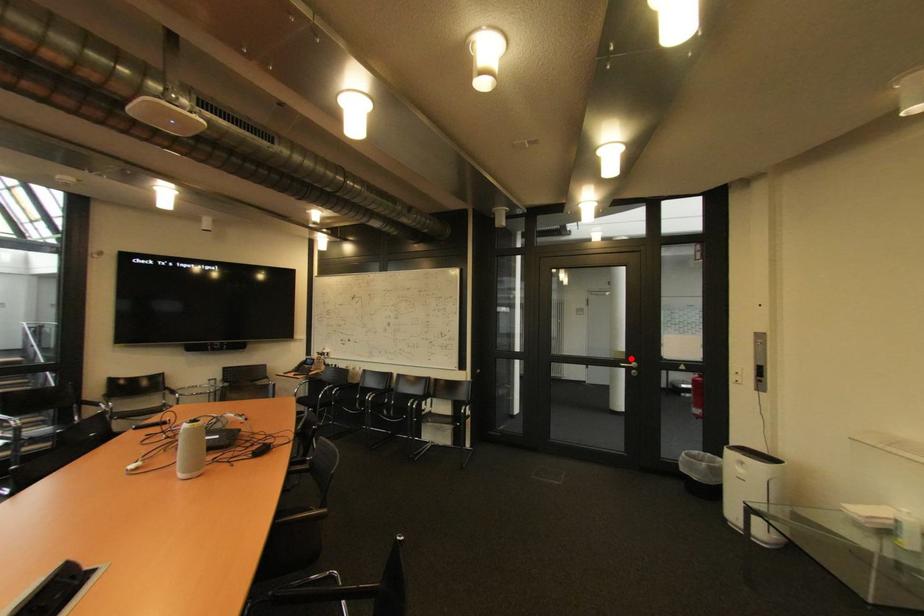
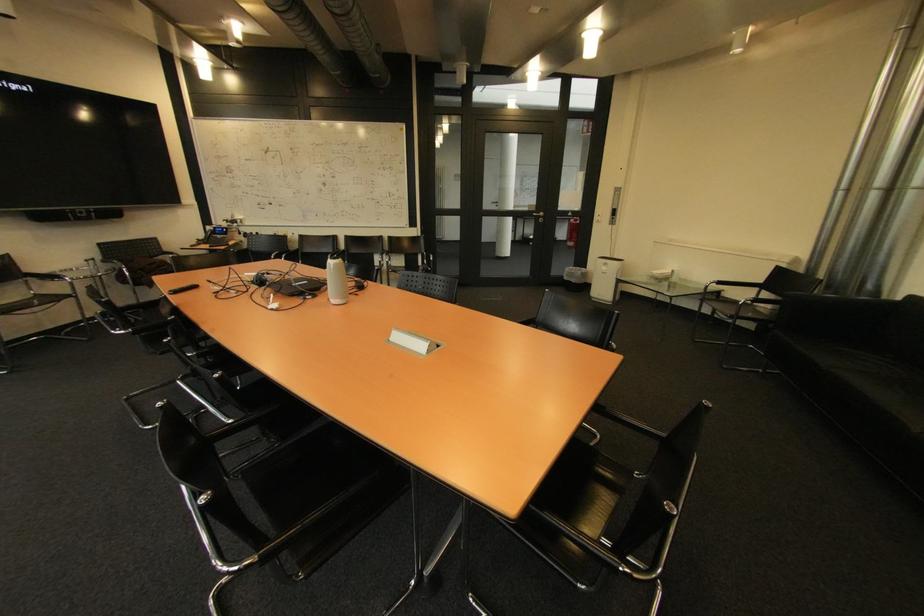
Question: I am providing you with two images of the same scene from different viewpoints. A red point is marked on the first image. Can you still see the location of the red point in image 2?

Choices:
 (A) Yes
 (B) No

Answer: (A)